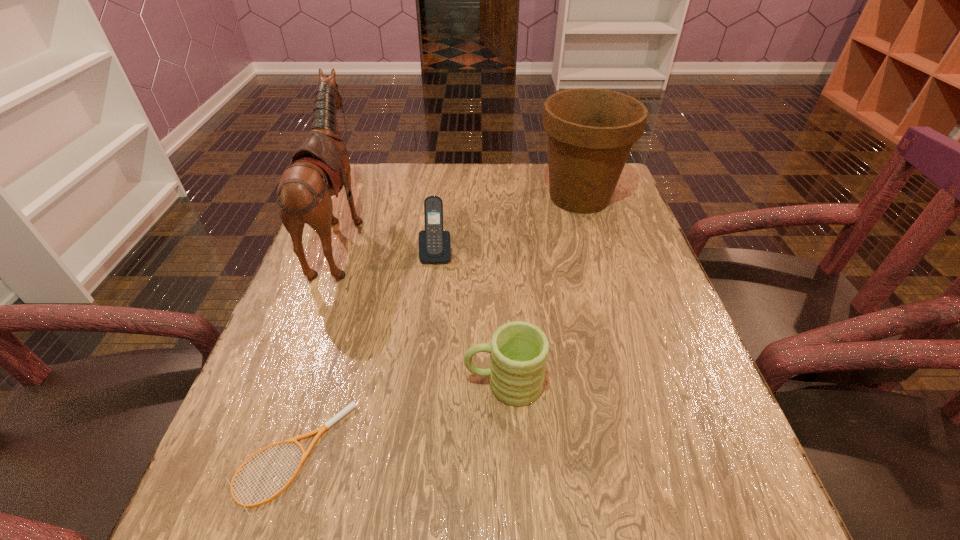
Identify the location of free spot located 0.060m on the front-facing side of the third shortest object. The width and height of the screenshot is (960, 540). (433, 282).

You are a GUI agent. You are given a task and a screenshot of the screen. Output one action in this format:
    pyautogui.click(x=<x>, y=<y>)
    Task: Click on the vacant area situated 0.190m on the side of the fourth tallest object with the handle
    
    Given the screenshot: What is the action you would take?
    pyautogui.click(x=360, y=384)

Locate an element on the screen. free space located 0.320m on the side of the fourth tallest object with the handle is located at coordinates (289, 384).

Find the location of a particular element. The image size is (960, 540). free region located on the side of the fourth tallest object with the handle is located at coordinates (355, 384).

The width and height of the screenshot is (960, 540). Identify the location of free location located 0.390m on the back of the shortest object. [354, 259].

In order to click on saddle present at the far edge in this screenshot , I will do `click(320, 167)`.

Locate an element on the screen. flowerpot that is at the far edge is located at coordinates (591, 131).

At what (x,y) coordinates should I click in order to perform the action: click on object positioned at the near edge. Please return your answer as a coordinate pair (x, y). The height and width of the screenshot is (540, 960). Looking at the image, I should click on (352, 405).

Where is `saddle located at the left edge`? The height and width of the screenshot is (540, 960). saddle located at the left edge is located at coordinates (320, 167).

I want to click on tennis racket that is at the left edge, so click(x=352, y=405).